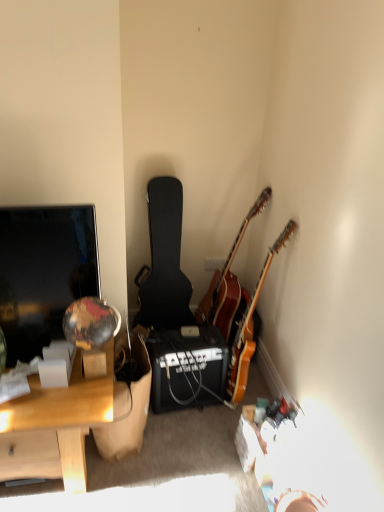
I want to click on vacant area located to the right-hand side of wooden desk at left, so click(185, 462).